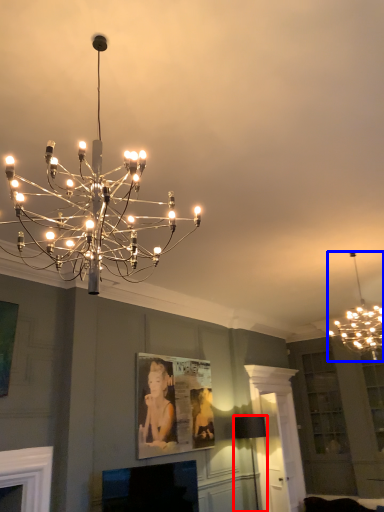
Question: Which object appears closest to the camera in this image, lamp (highlighted by a red box) or lamp (highlighted by a blue box)?

Choices:
 (A) lamp
 (B) lamp

Answer: (B)